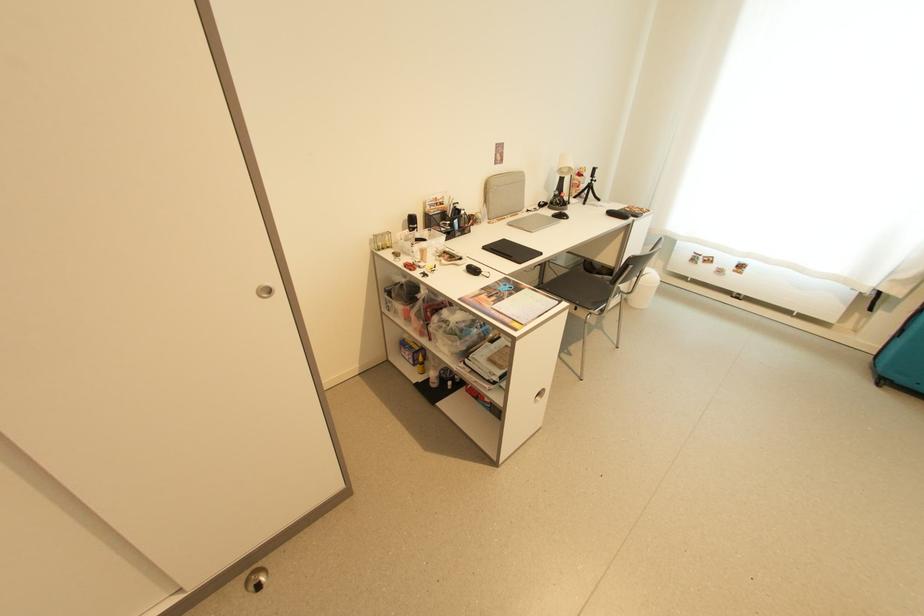
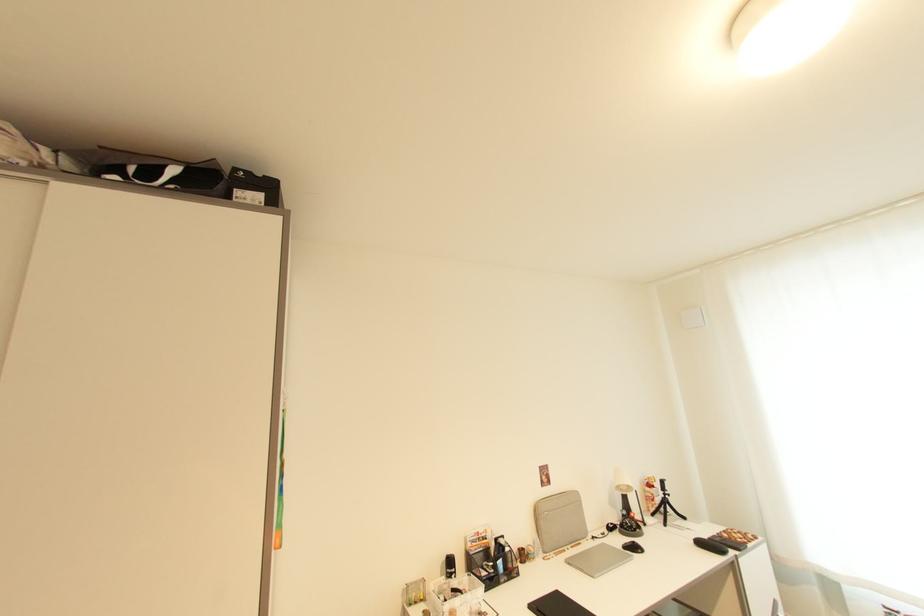
The point at (566,217) is marked in the first image. Where is the corresponding point in the second image?

(639, 549)